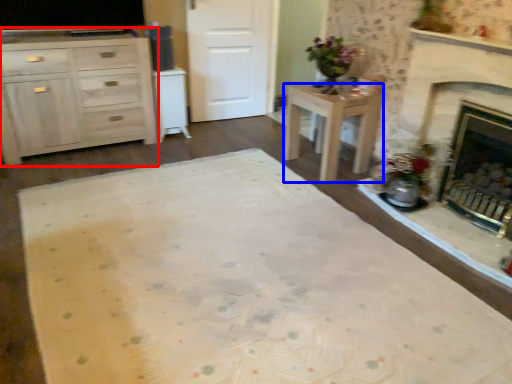
Question: Which of the following is the farthest to the observer, cabinetry (highlighted by a red box) or desk (highlighted by a blue box)?

Choices:
 (A) cabinetry
 (B) desk

Answer: (B)